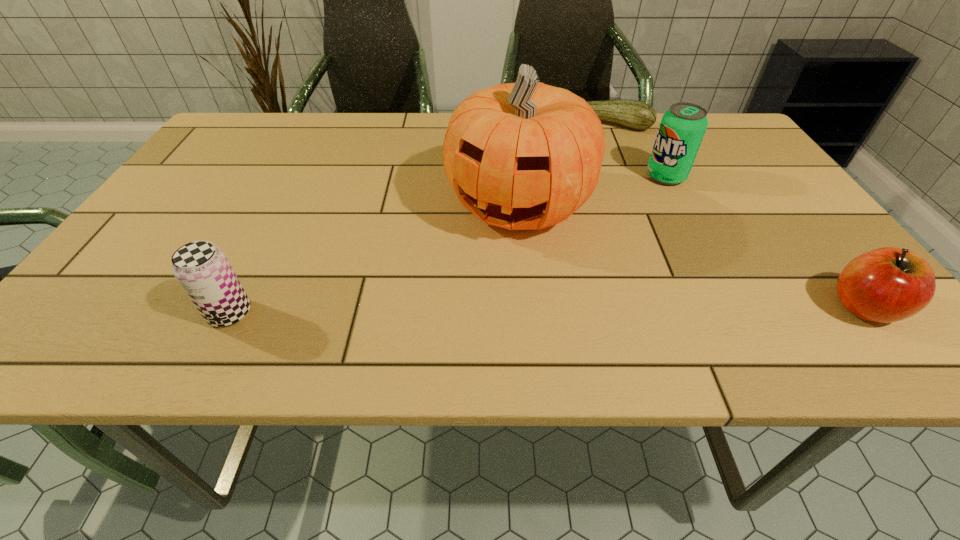
Where is `free location that satisfies the following two spatial constraints: 1. on the back side of the tallest object; 2. on the left side of the pop soda`? free location that satisfies the following two spatial constraints: 1. on the back side of the tallest object; 2. on the left side of the pop soda is located at coordinates (516, 177).

Locate an element on the screen. vacant space that satisfies the following two spatial constraints: 1. on the front side of the zucchini; 2. on the left side of the apple is located at coordinates (680, 307).